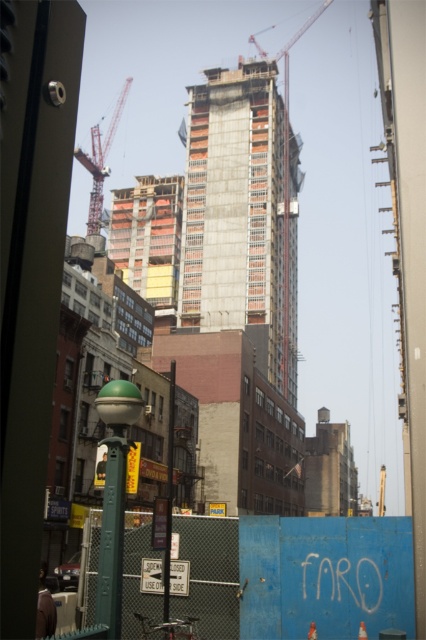
You are a delivery person trying to navigate through the construction area. You see the red metal crane at upper left and the metallic construction crane at upper center. Which crane is closer to you?

The red metal crane at upper left is smaller in size compared to the metallic construction crane at upper center, so it might be farther away since smaller objects can appear closer or farther depending on distance. However, based on the description, the red metal crane at upper left is smaller, which could mean it is farther away. But without depth cues, we cannot definitively determine which is closer solely based on size.

You are a delivery person needing to navigate around the blue painted metal fence at lower center and the red metal crane at upper left. Given that the distance between them is 430.79 feet, can you safely maneuver your delivery van which has a turning radius of 40 feet?

The distance between the blue painted metal fence at lower center and the red metal crane at upper left is 430.79 feet, so yes, the delivery van can safely maneuver between them since the distance is much greater than the van turning radius of 40 feet.